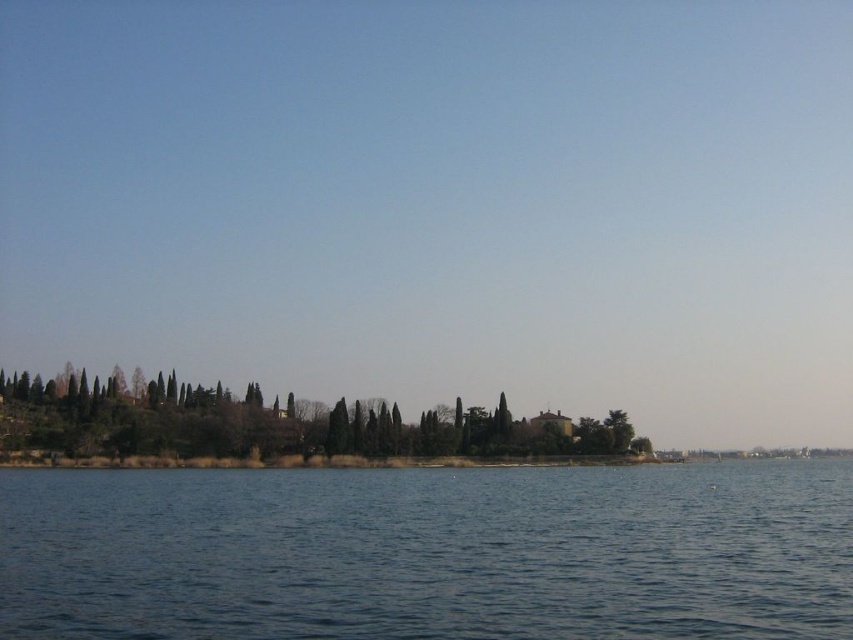
Question: Among these points, which one is farthest from the camera?

Choices:
 (A) (274, 412)
 (B) (90, 529)

Answer: (A)

Question: Is the position of blue water at center more distant than that of green textured trees at center?

Choices:
 (A) yes
 (B) no

Answer: (B)

Question: Which of the following is the farthest from the observer?

Choices:
 (A) green textured trees at center
 (B) blue water at center

Answer: (A)

Question: From the image, what is the correct spatial relationship of blue water at center in relation to green textured trees at center?

Choices:
 (A) left
 (B) right

Answer: (B)

Question: Can you confirm if blue water at center is positioned to the left of green textured trees at center?

Choices:
 (A) yes
 (B) no

Answer: (B)